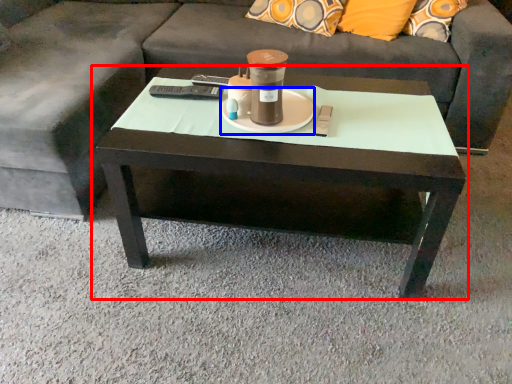
Question: Which of the following is the closest to the observer, coffee table (highlighted by a red box) or saucer (highlighted by a blue box)?

Choices:
 (A) coffee table
 (B) saucer

Answer: (A)